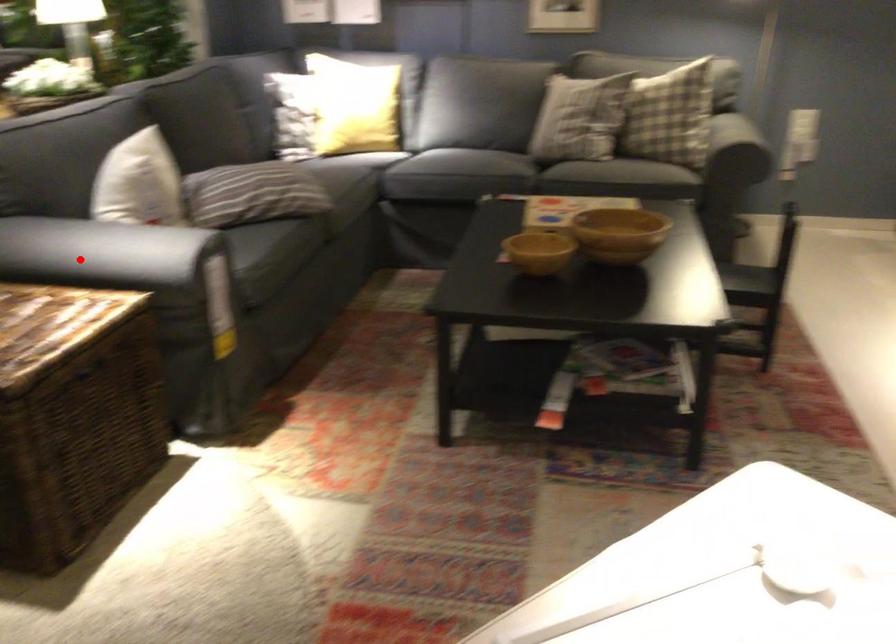
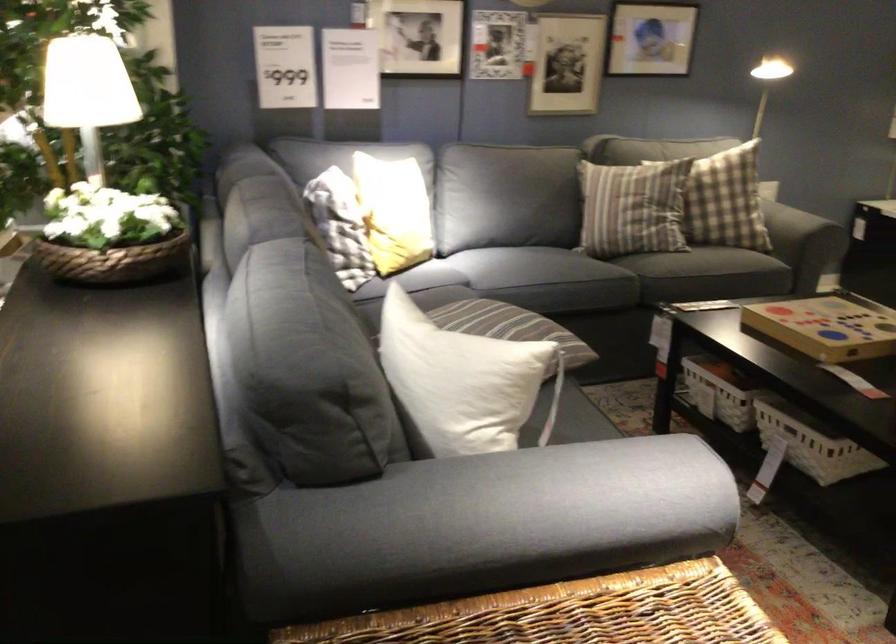
Question: I am providing you with two images of the same scene from different viewpoints. Given a red point in image1, look at the same physical point in image2. Is it:

Choices:
 (A) Closer to the viewpoint
 (B) Farther from the viewpoint

Answer: (A)